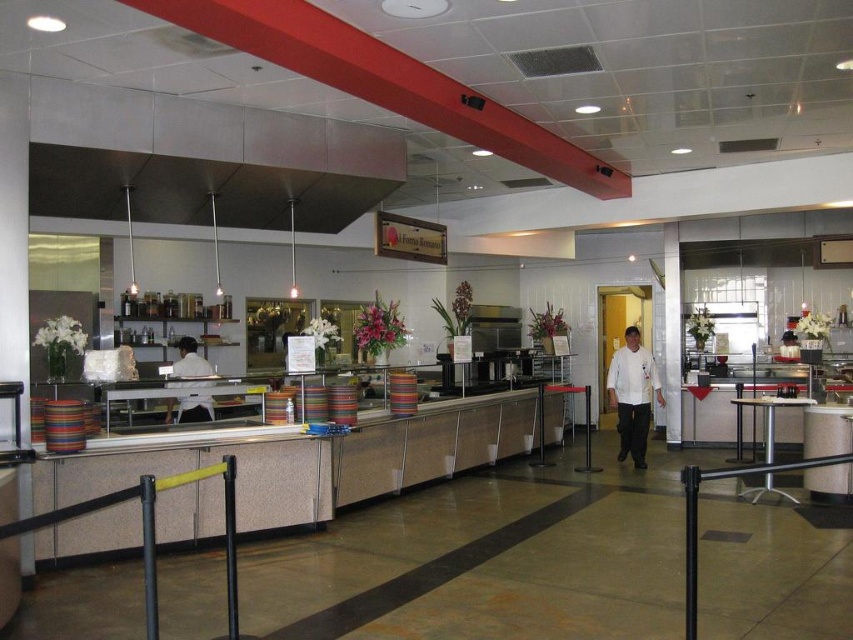
You are a customer in the cafeteria and you want to ask for a refill. You see two staff members, the white chef coat at center and the white shirt at center. Which staff member is standing to the right of the other?

The white chef coat at center is positioned on the right side of white shirt at center, so the white chef coat at center is to the right of the white shirt at center.

Consider the image. You are a customer trying to determine which staff member is closer to the counter. You see a white chef coat at center and a white shirt at center. Which one is positioned closer to the counter?

The white chef coat at center is positioned closer to the counter than the white shirt at center because the description states that the white chef coat at center might be wider than white shirt at center, implying proximity to the counter.